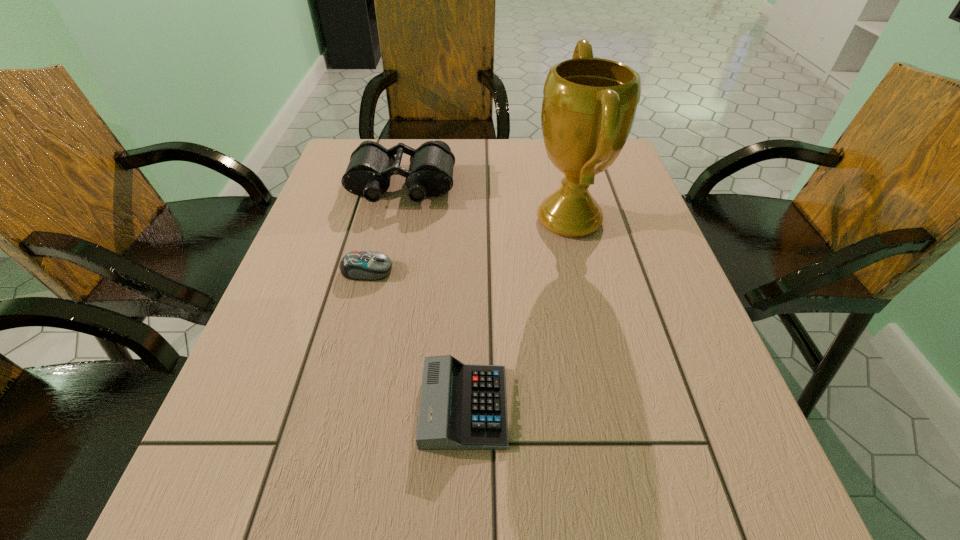
What are the coordinates of `free space at the left edge of the desktop` in the screenshot? It's located at (314, 253).

The width and height of the screenshot is (960, 540). In order to click on free space at the right edge of the desktop in this screenshot , I will do `click(618, 238)`.

Identify the location of vacant space at the far left corner of the desktop. (354, 149).

I want to click on vacant space at the far right corner, so click(604, 180).

This screenshot has height=540, width=960. In the image, there is a desktop. Find the location of `blank space at the near right corner`. blank space at the near right corner is located at coordinates (766, 535).

Identify the location of free spot between the rightmost object and the nearest object. (516, 313).

Where is `empty space between the computer mouse and the calculator`? This screenshot has width=960, height=540. empty space between the computer mouse and the calculator is located at coordinates (416, 338).

Locate an element on the screen. The image size is (960, 540). vacant region between the calculator and the rightmost object is located at coordinates (516, 313).

The height and width of the screenshot is (540, 960). I want to click on free point between the nearest object and the computer mouse, so click(x=416, y=338).

Locate an element on the screen. vacant space in between the computer mouse and the calculator is located at coordinates (416, 338).